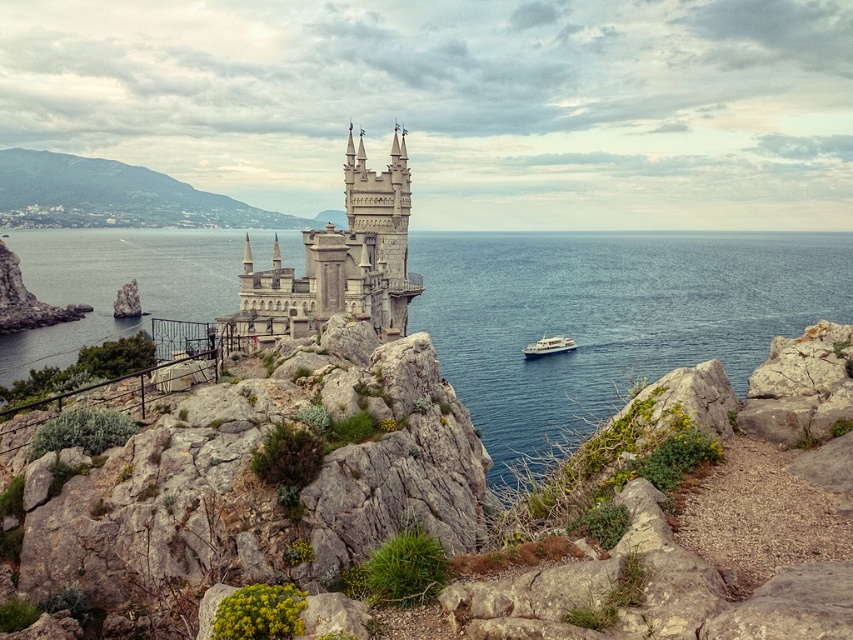
Question: Which of the following is the farthest from the observer?

Choices:
 (A) green grassy hillside at upper left
 (B) white glossy boat at center
 (C) stone castle at center

Answer: (A)

Question: Does stone castle at center appear under white glossy boat at center?

Choices:
 (A) yes
 (B) no

Answer: (B)

Question: Which of these objects is positioned closest to the stone castle at center?

Choices:
 (A) blue water at center
 (B) white glossy boat at center

Answer: (B)

Question: Does blue water at center appear on the right side of stone castle at center?

Choices:
 (A) yes
 (B) no

Answer: (B)

Question: Can you confirm if blue water at center is thinner than green grassy hillside at upper left?

Choices:
 (A) yes
 (B) no

Answer: (B)

Question: Which of the following is the farthest from the observer?

Choices:
 (A) (164, 182)
 (B) (560, 352)
 (C) (817, 259)
 (D) (296, 317)

Answer: (A)